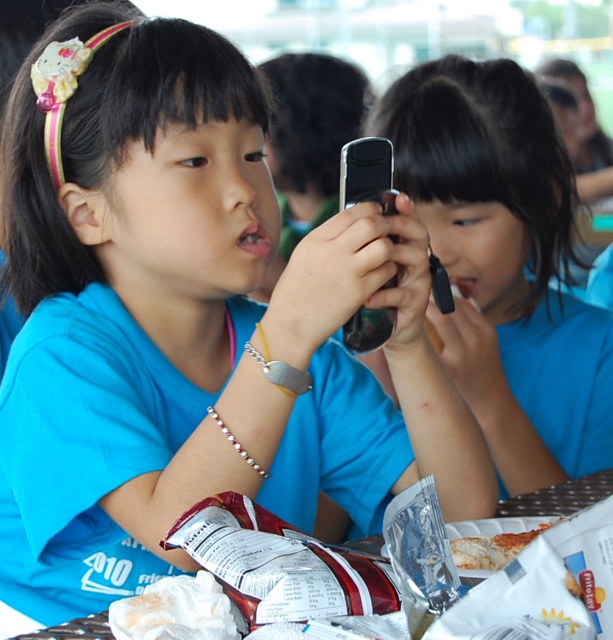
Question: Is matte black phone at center further to the viewer compared to silver metallic phone at center?

Choices:
 (A) no
 (B) yes

Answer: (B)

Question: Which object is positioned closest to the silver metallic phone at center?

Choices:
 (A) white paper plate at lower center
 (B) matte black phone at center
 (C) metallic silver table at lower center

Answer: (A)

Question: Can you confirm if silver metallic phone at center is thinner than white paper plate at lower center?

Choices:
 (A) no
 (B) yes

Answer: (B)

Question: Can you confirm if matte black phone at center is bigger than white paper plate at lower center?

Choices:
 (A) yes
 (B) no

Answer: (A)

Question: Estimate the real-world distances between objects in this image. Which object is farther from the white paper plate at lower center?

Choices:
 (A) metallic silver table at lower center
 (B) silver metallic phone at center
 (C) matte black phone at center

Answer: (C)

Question: Among these objects, which one is farthest from the camera?

Choices:
 (A) silver metallic phone at center
 (B) metallic silver table at lower center

Answer: (B)